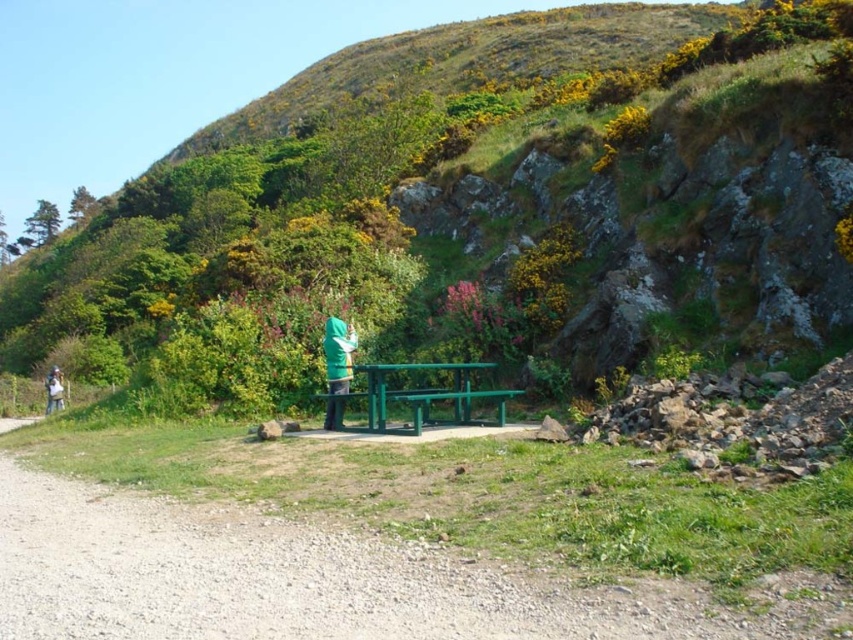
Question: Observing the image, what is the correct spatial positioning of green metallic picnic table at center in reference to green fabric jacket at center?

Choices:
 (A) below
 (B) above

Answer: (B)

Question: Is green grassy hillside at center below green metallic picnic table at center?

Choices:
 (A) yes
 (B) no

Answer: (B)

Question: Among these objects, which one is nearest to the camera?

Choices:
 (A) green metal bench at center
 (B) green grassy hillside at center
 (C) green metallic picnic table at center

Answer: (A)

Question: Does green grassy hillside at center have a smaller size compared to green metal bench at center?

Choices:
 (A) no
 (B) yes

Answer: (A)

Question: Which point is farther to the camera?

Choices:
 (A) coord(299,605)
 (B) coord(57,392)
 (C) coord(329,397)

Answer: (B)

Question: Which object is farther from the camera taking this photo?

Choices:
 (A) green matte jacket at center
 (B) green metal bench at center
 (C) green metallic picnic table at center

Answer: (A)